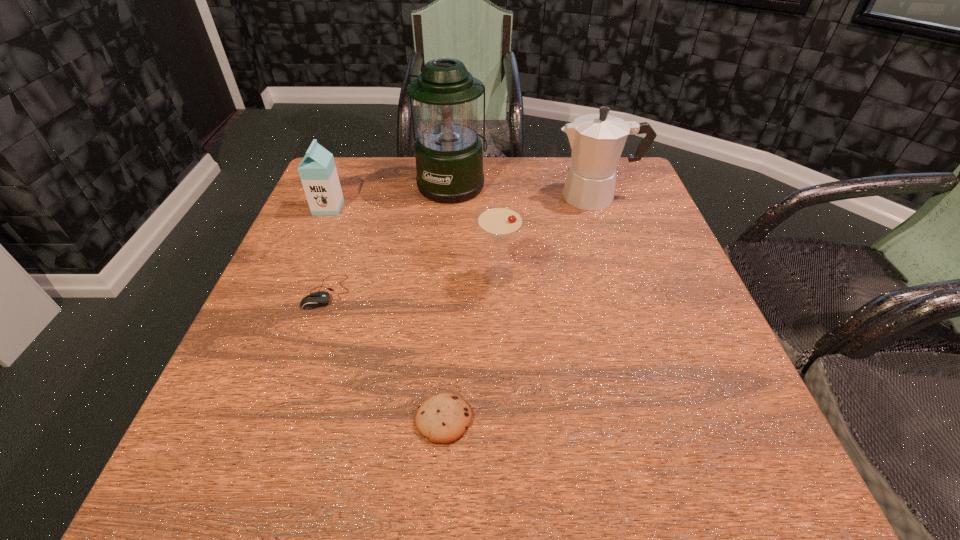
Where is `the tallest object`? the tallest object is located at coordinates (x=449, y=159).

Find the location of a particular element. This screenshot has width=960, height=540. the rightmost object is located at coordinates coord(597,140).

I want to click on coffeepot, so click(x=597, y=140).

Where is `milk carton`? The width and height of the screenshot is (960, 540). milk carton is located at coordinates (318, 173).

You are a GUI agent. You are given a task and a screenshot of the screen. Output one action in this format:
    pyautogui.click(x=<x>, y=<y>)
    Task: Click on the martini
    The height and width of the screenshot is (540, 960).
    Given the screenshot: What is the action you would take?
    pyautogui.click(x=499, y=222)

Find the location of a particular element. The image size is (960, 540). the nearest object is located at coordinates (443, 418).

Find the location of a particular element. computer mouse is located at coordinates [x=314, y=300].

At what (x,y) coordinates should I click in order to perform the action: click on free space located on the front of the lantern. Please return your answer as a coordinate pair (x, y). The height and width of the screenshot is (540, 960). Looking at the image, I should click on (447, 247).

What are the coordinates of `blank space located at the spout of the fifth shortest object` in the screenshot? It's located at (477, 197).

The height and width of the screenshot is (540, 960). Find the location of `vacant region located at the spout of the fifth shortest object`. vacant region located at the spout of the fifth shortest object is located at coordinates tap(512, 197).